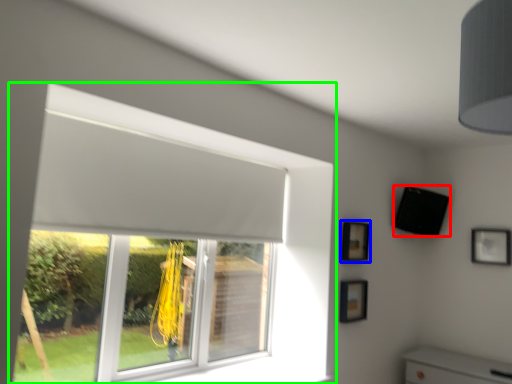
Question: Based on their relative distances, which object is nearer to speaker (highlighted by a red box)? Choose from picture frame (highlighted by a blue box) and window (highlighted by a green box).

Choices:
 (A) picture frame
 (B) window

Answer: (A)